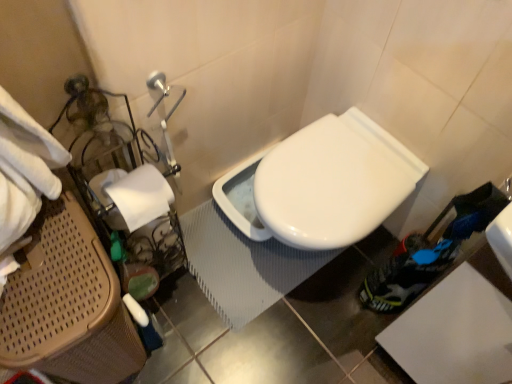
Consider the image. What is the approximate height of white glossy toilet at center?

It is 32.85 centimeters.

You are a GUI agent. You are given a task and a screenshot of the screen. Output one action in this format:
    pyautogui.click(x=<x>, y=<y>)
    Task: Click on the white matte toilet paper at left
    The image size is (512, 384).
    Given the screenshot: What is the action you would take?
    pyautogui.click(x=141, y=196)

Looking at this image, is brown woven laundry basket at left in front of or behind white glossy toilet at center in the image?

brown woven laundry basket at left is positioned closer to the viewer than white glossy toilet at center.

Is brown woven laundry basket at left taller than white glossy toilet at center?

Correct, brown woven laundry basket at left is much taller as white glossy toilet at center.

Is point (85, 327) closer or farther from the camera than point (316, 202)?

Point (85, 327) is positioned closer to the camera compared to point (316, 202).

From a real-world perspective, who is located lower, brown woven laundry basket at left or white glossy toilet at center?

In real-world perspective, white glossy toilet at center is lower.

From the image's perspective, which one is positioned lower, white glossy toilet at center or brown woven laundry basket at left?

From the image's view, brown woven laundry basket at left is below.

Is white glossy toilet at center next to brown woven laundry basket at left?

No.

Is brown woven laundry basket at left at the back of white glossy toilet at center?

No.

Is brown woven laundry basket at left inside white glossy toilet at center?

No, brown woven laundry basket at left is not surrounded by white glossy toilet at center.

In terms of height, does white matte toilet paper at left look taller or shorter compared to brown woven laundry basket at left?

Considering their sizes, white matte toilet paper at left has less height than brown woven laundry basket at left.

Which object is thinner, white matte toilet paper at left or brown woven laundry basket at left?

With smaller width is white matte toilet paper at left.

Considering their positions, is white matte toilet paper at left located in front of or behind brown woven laundry basket at left?

white matte toilet paper at left is positioned farther from the viewer than brown woven laundry basket at left.

Is white glossy toilet at center smaller than white matte toilet paper at left?

Incorrect, white glossy toilet at center is not smaller in size than white matte toilet paper at left.

Considering the sizes of objects white glossy toilet at center and white matte toilet paper at left in the image provided, who is thinner, white glossy toilet at center or white matte toilet paper at left?

white matte toilet paper at left is thinner.

Would you say white glossy toilet at center is to the left or to the right of white matte toilet paper at left in the picture?

From the image, it's evident that white glossy toilet at center is to the right of white matte toilet paper at left.

The width and height of the screenshot is (512, 384). Identify the location of toilet lying on the right of white matte toilet paper at left. (327, 183).

Is white matte toilet paper at left directly adjacent to white glossy toilet at center?

No, white matte toilet paper at left is not in contact with white glossy toilet at center.

Is point (133, 209) closer to camera compared to point (296, 158)?

That is True.

Where is `toilet paper that is on the left side of white glossy toilet at center`? This screenshot has width=512, height=384. toilet paper that is on the left side of white glossy toilet at center is located at coordinates (141, 196).

Is brown woven laundry basket at left directly adjacent to white matte toilet paper at left?

No, brown woven laundry basket at left is not next to white matte toilet paper at left.

Locate an element on the screen. laundry basket on the left of the white matte toilet paper at left is located at coordinates (68, 304).

Considering the positions of point (83, 356) and point (135, 210), is point (83, 356) closer or farther from the camera than point (135, 210)?

Clearly, point (83, 356) is more distant from the camera than point (135, 210).

In the image, is brown woven laundry basket at left positioned in front of or behind white matte toilet paper at left?

Clearly, brown woven laundry basket at left is in front of white matte toilet paper at left.

Locate an element on the screen. The width and height of the screenshot is (512, 384). toilet above the brown woven laundry basket at left (from the image's perspective) is located at coordinates (327, 183).

The width and height of the screenshot is (512, 384). In order to click on laundry basket on the left side of white glossy toilet at center in this screenshot , I will do `click(68, 304)`.

From the image, which object appears to be nearer to brown woven laundry basket at left, white matte toilet paper at left or white glossy toilet at center?

white matte toilet paper at left is closer to brown woven laundry basket at left.

Considering their positions, is white matte toilet paper at left positioned further to white glossy toilet at center than brown woven laundry basket at left?

brown woven laundry basket at left is positioned further to the anchor white glossy toilet at center.

Based on their spatial positions, is white glossy toilet at center or brown woven laundry basket at left closer to white matte toilet paper at left?

brown woven laundry basket at left lies closer to white matte toilet paper at left than the other object.

Based on their spatial positions, is brown woven laundry basket at left or white matte toilet paper at left further from white glossy toilet at center?

Based on the image, brown woven laundry basket at left appears to be further to white glossy toilet at center.

From the image, which object appears to be farther from brown woven laundry basket at left, white glossy toilet at center or white matte toilet paper at left?

white glossy toilet at center lies further to brown woven laundry basket at left than the other object.

When comparing their distances from white matte toilet paper at left, does brown woven laundry basket at left or white glossy toilet at center seem further?

Among the two, white glossy toilet at center is located further to white matte toilet paper at left.

Where is `toilet paper situated between brown woven laundry basket at left and white glossy toilet at center from left to right`? This screenshot has width=512, height=384. toilet paper situated between brown woven laundry basket at left and white glossy toilet at center from left to right is located at coordinates (141, 196).